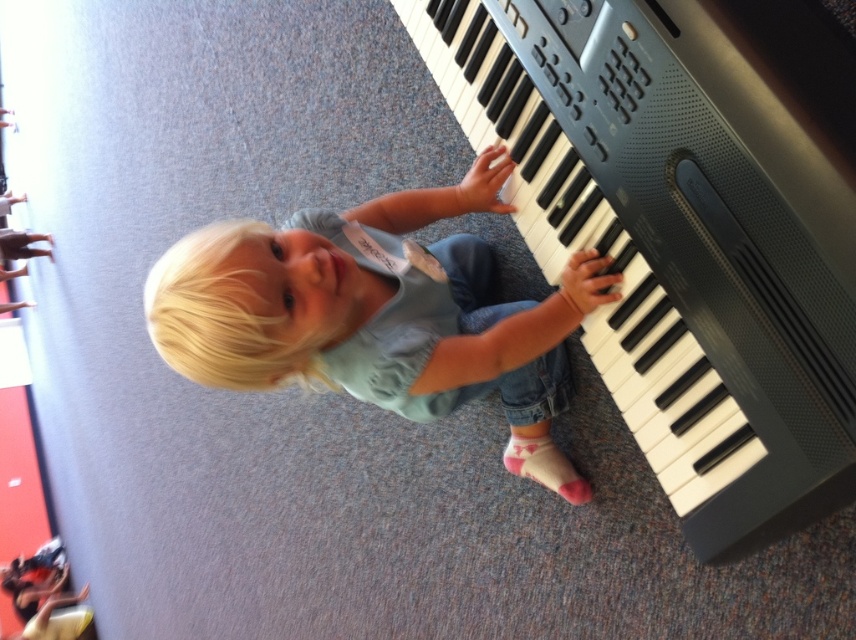
Question: Can you confirm if black plastic keyboard at right is positioned to the left of blonde hair at center?

Choices:
 (A) no
 (B) yes

Answer: (A)

Question: Which object appears farthest from the camera in this image?

Choices:
 (A) black plastic keyboard at right
 (B) blonde hair at center

Answer: (B)

Question: Which point is closer to the camera?

Choices:
 (A) (526, 444)
 (B) (782, 161)

Answer: (B)

Question: Can you confirm if black plastic keyboard at right is bigger than blonde hair at center?

Choices:
 (A) yes
 (B) no

Answer: (B)

Question: Does black plastic keyboard at right appear on the right side of blonde hair at center?

Choices:
 (A) no
 (B) yes

Answer: (B)